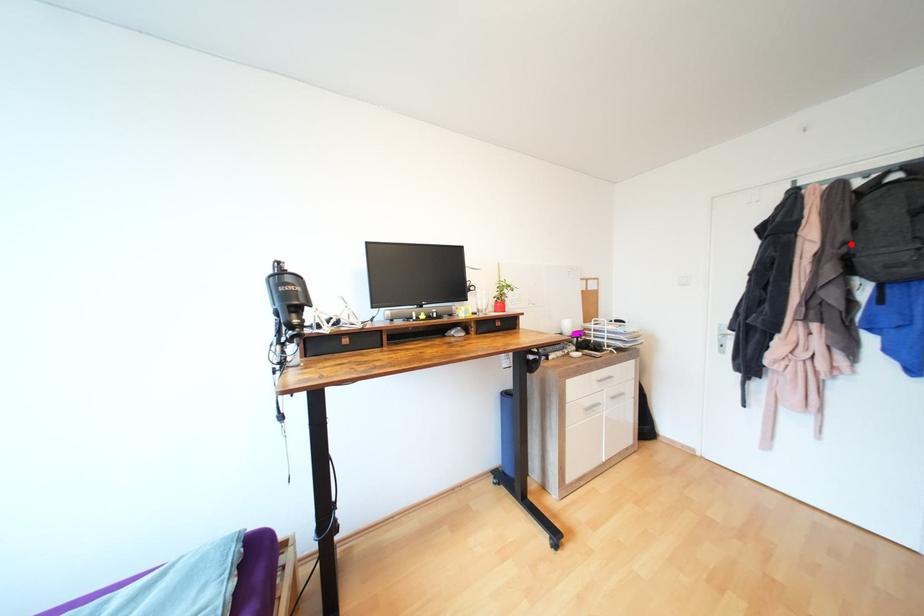
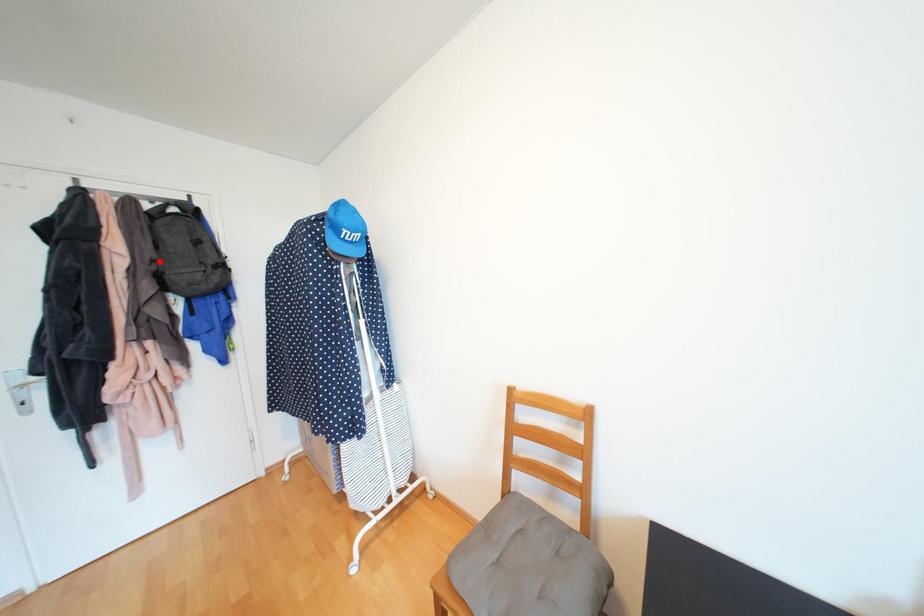
I am providing you with two images of the same scene from different viewpoints. A red point is marked on the first image and another point is marked on the second image. Are the points marked in image1 and image2 representing the same 3D position?

Yes